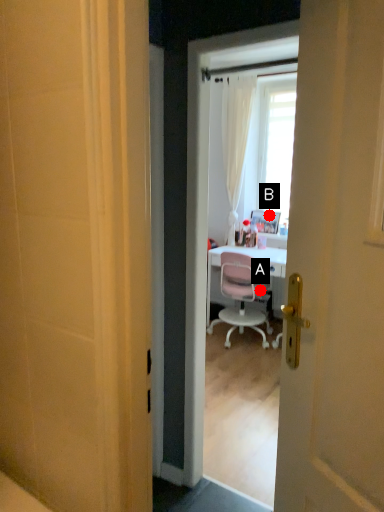
Question: Two points are circled on the image, labeled by A and B beside each circle. Which of the following is the closest to the observer?

Choices:
 (A) A is closer
 (B) B is closer

Answer: (A)